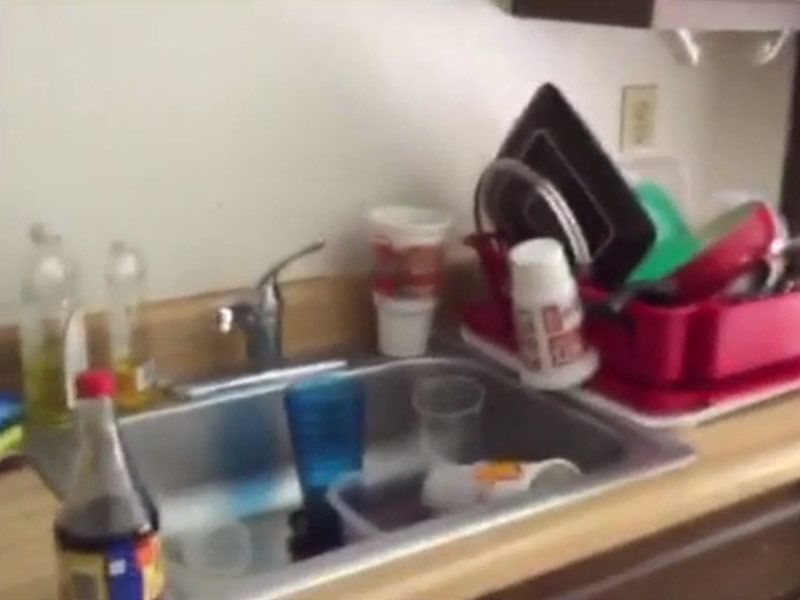
You are a GUI agent. You are given a task and a screenshot of the screen. Output one action in this format:
    pyautogui.click(x=<x>, y=<y>)
    Task: Click on the counter top
    
    Given the screenshot: What is the action you would take?
    pyautogui.click(x=717, y=478), pyautogui.click(x=18, y=517)